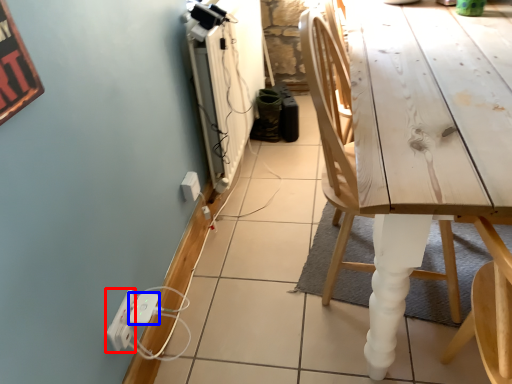
Question: Among these objects, which one is nearest to the camera, electric outlet (highlighted by a red box) or extension cord (highlighted by a blue box)?

Choices:
 (A) electric outlet
 (B) extension cord

Answer: (A)